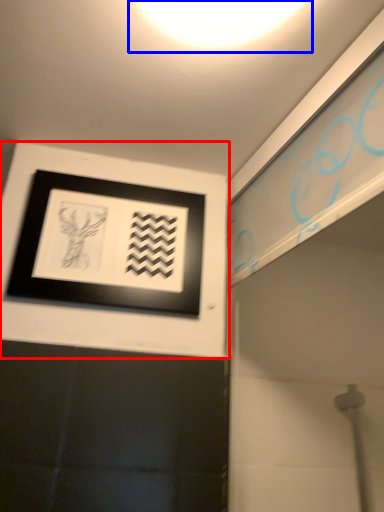
Question: Among these objects, which one is nearest to the camera, picture frame (highlighted by a red box) or light (highlighted by a blue box)?

Choices:
 (A) picture frame
 (B) light

Answer: (B)